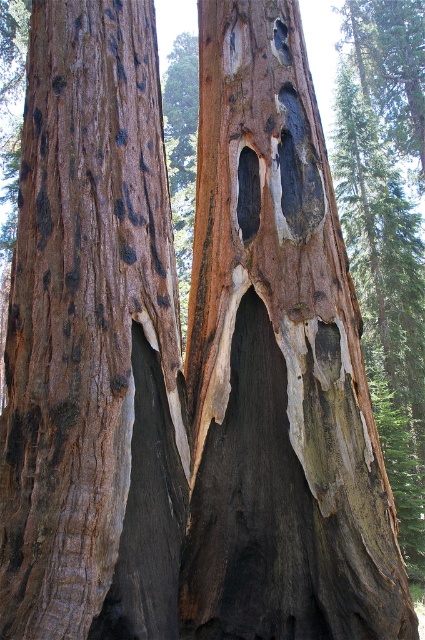
Question: Which object is the farthest from the dark brown wood at center?

Choices:
 (A) smooth dark wood hole at center
 (B) dark gray wood hole at upper center
 (C) black rough hole at center
 (D) matte brown bark at center

Answer: (B)

Question: Can you confirm if matte brown bark at center is positioned to the right of smooth dark wood hole at center?

Choices:
 (A) no
 (B) yes

Answer: (A)

Question: Among these points, which one is farthest from the camera?

Choices:
 (A) (280, 134)
 (B) (274, 20)
 (C) (272, 227)
 (D) (169, 326)

Answer: (B)

Question: Among these objects, which one is nearest to the camera?

Choices:
 (A) smooth dark wood hole at center
 (B) black rough hole at center

Answer: (B)

Question: Is black rough hole at center smaller than dark gray wood hole at upper center?

Choices:
 (A) no
 (B) yes

Answer: (A)

Question: Does matte brown bark at center appear over smooth dark wood hole at center?

Choices:
 (A) yes
 (B) no

Answer: (B)